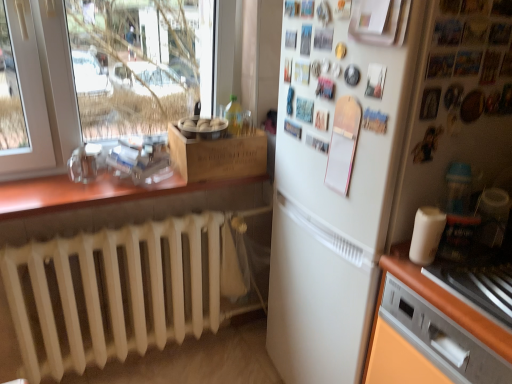
Question: From a real-world perspective, is white matte refrigerator at center positioned above or below white matte cup at right?

Choices:
 (A) below
 (B) above

Answer: (A)

Question: Is point (294, 332) closer or farther from the camera than point (418, 243)?

Choices:
 (A) closer
 (B) farther

Answer: (B)

Question: Estimate the real-world distances between objects in this image. Which object is farther from the white matte cup at right?

Choices:
 (A) white matte radiator at lower left
 (B) brown wood countertop at left
 (C) wooden crate at center
 (D) white matte refrigerator at center
 (E) metallic silver dishwasher at lower right

Answer: (A)

Question: Which is nearer to the metallic silver dishwasher at lower right?

Choices:
 (A) wooden crate at center
 (B) white matte cup at right
 (C) white matte refrigerator at center
 (D) white matte radiator at lower left
 (E) brown wood countertop at left

Answer: (B)